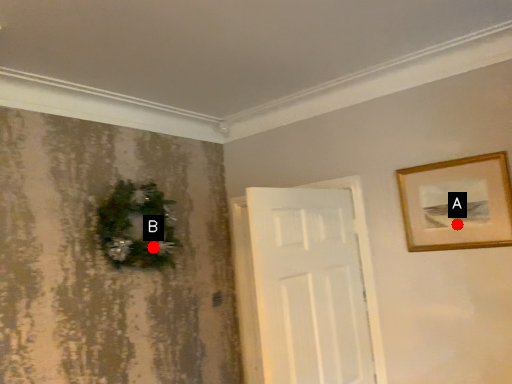
Question: Two points are circled on the image, labeled by A and B beside each circle. Which point is closer to the camera?

Choices:
 (A) A is closer
 (B) B is closer

Answer: (A)